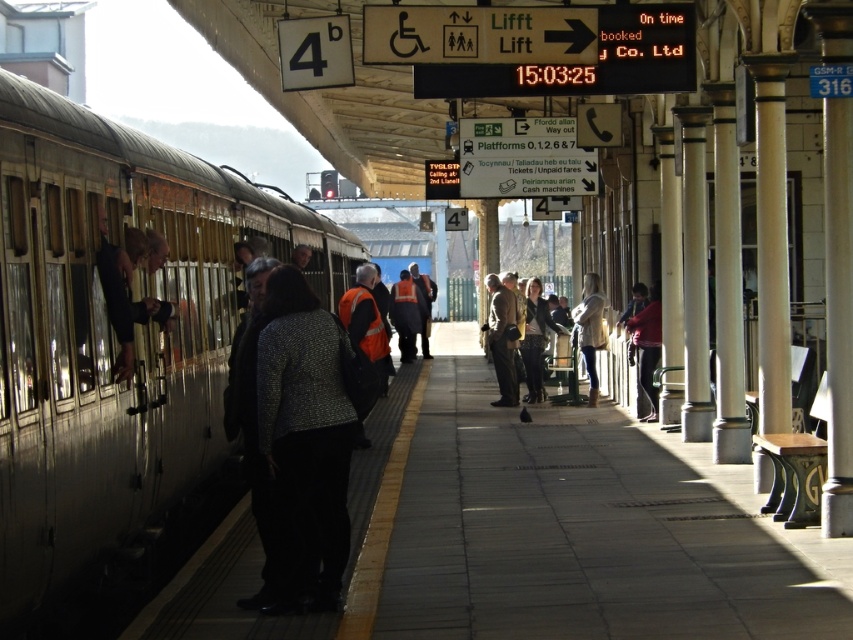
Question: Can you confirm if silver metallic train at left is smaller than brown leather jacket at center?

Choices:
 (A) yes
 (B) no

Answer: (B)

Question: In this image, where is silver metallic train at left located relative to brown leather jacket at center?

Choices:
 (A) below
 (B) above

Answer: (B)

Question: Is silver metallic train at left positioned before brown leather jacket at center?

Choices:
 (A) yes
 (B) no

Answer: (A)

Question: Among these objects, which one is farthest from the camera?

Choices:
 (A) silver metallic train at left
 (B) brown leather jacket at center

Answer: (B)

Question: Among these points, which one is farthest from the camera?

Choices:
 (A) (90, 116)
 (B) (503, 305)

Answer: (B)